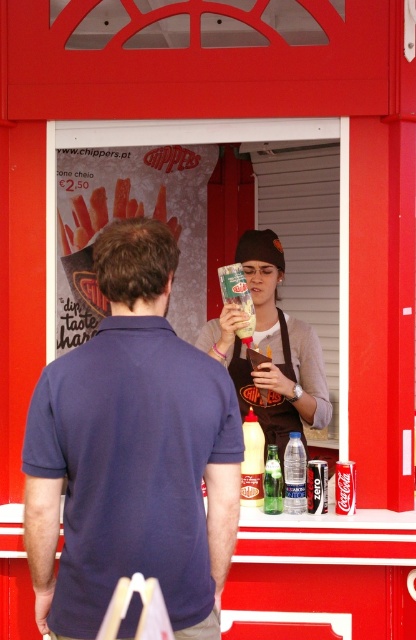
Question: Estimate the real-world distances between objects in this image. Which object is farther from the green glass bottle at center?

Choices:
 (A) yellow plastic bottle at center
 (B) clear plastic bottle at center
 (C) matte cardboard sign at center
 (D) navy blue polo shirt at center

Answer: (C)

Question: Is navy blue polo shirt at center positioned in front of clear plastic bottle at center?

Choices:
 (A) yes
 (B) no

Answer: (A)

Question: Which object is positioned closest to the green glass bottle at center?

Choices:
 (A) clear plastic bottle at center
 (B) navy blue polo shirt at center
 (C) brown fabric apron at center
 (D) yellow plastic bottle at center

Answer: (A)

Question: Can you confirm if brown fabric apron at center is bigger than matte cardboard sign at center?

Choices:
 (A) no
 (B) yes

Answer: (A)

Question: Can you confirm if navy blue polo shirt at center is positioned below brown fabric apron at center?

Choices:
 (A) yes
 (B) no

Answer: (A)

Question: Which is nearer to the clear plastic bottle at center?

Choices:
 (A) yellow plastic bottle at center
 (B) navy blue polo shirt at center
 (C) matte cardboard sign at center

Answer: (A)